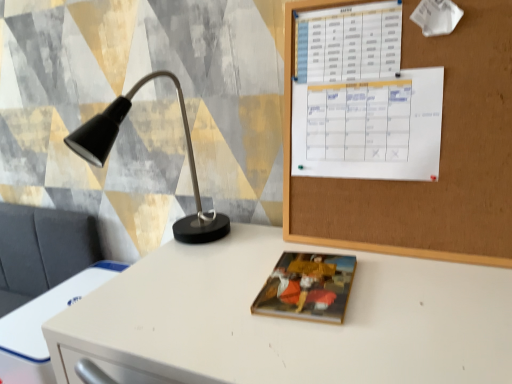
Question: Considering their positions, is matte paper book at center located in front of or behind white paper calendar at upper right?

Choices:
 (A) front
 (B) behind

Answer: (A)

Question: Is matte paper book at center inside or outside of white paper calendar at upper right?

Choices:
 (A) inside
 (B) outside

Answer: (B)

Question: Which object is the closest to the white paper calendar at upper right?

Choices:
 (A) matte black lamp at left
 (B) white plastic drawer at lower left
 (C) corkboard at upper right
 (D) white glossy desk at center
 (E) matte paper book at center

Answer: (C)

Question: Which is farther from the matte paper book at center?

Choices:
 (A) white glossy desk at center
 (B) white paper calendar at upper right
 (C) white plastic drawer at lower left
 (D) matte black lamp at left
 (E) corkboard at upper right

Answer: (C)